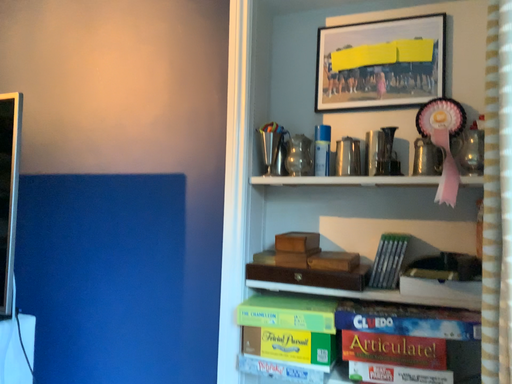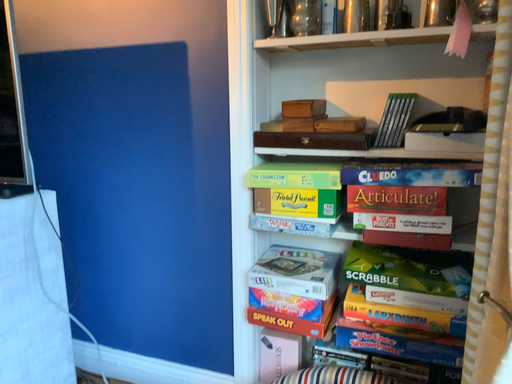
Question: Which way did the camera rotate in the video?

Choices:
 (A) rotated downward
 (B) rotated upward

Answer: (A)